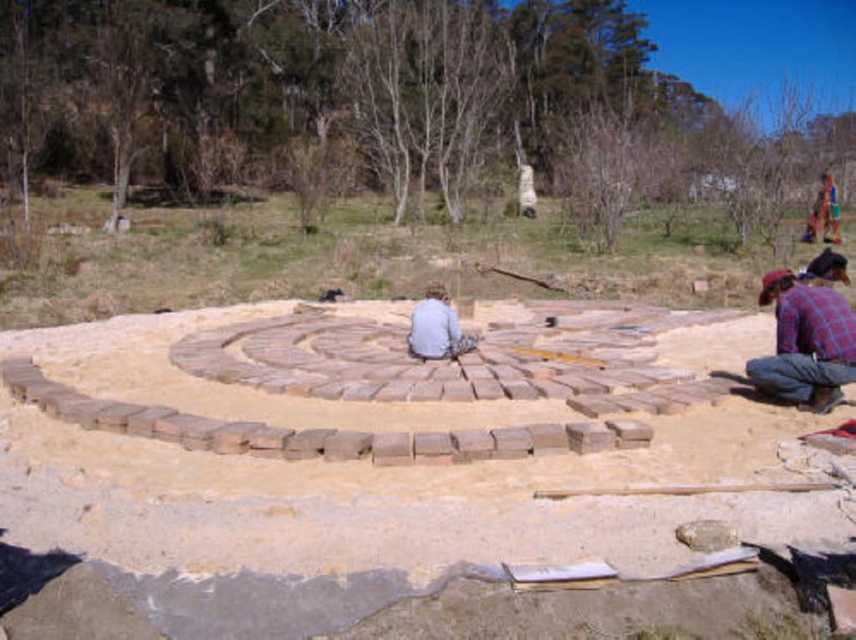
You are a visitor observing the construction of the brown brick maze at center and the person in plaid fabric shirt at lower right. From your viewpoint, which object is positioned higher in the scene?

The plaid fabric shirt at lower right is positioned higher than the brown brick maze at center because the maze is located below the shirt.

You are part of the construction team working on the labyrinth. You need to place a new section of bricks to the right of the light gray fabric at center. According to the scene, where should you position this new section relative to the brown brick maze at center?

The brown brick maze at center is to the left of the light gray fabric at center. Therefore, placing the new section to the right of the light gray fabric at center would position it to the right of the brown brick maze at center.

You are a construction supervisor who needs to ensure safety distances between workers. According to safety regulations, workers must maintain at least 3 meters apart. Are the plaid fabric shirt at lower right and light gray fabric at center complying with the safety distance requirement?

The plaid fabric shirt at lower right and light gray fabric at center are 3.60 meters apart from each other, which exceeds the required 3 meters distance, so they are complying with the safety distance requirement.